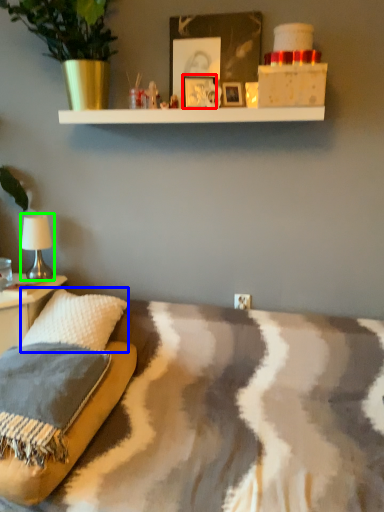
Question: Which object is positioned closest to picture frame (highlighted by a red box)? Select from throw pillow (highlighted by a blue box) and table lamp (highlighted by a green box).

Choices:
 (A) throw pillow
 (B) table lamp

Answer: (B)